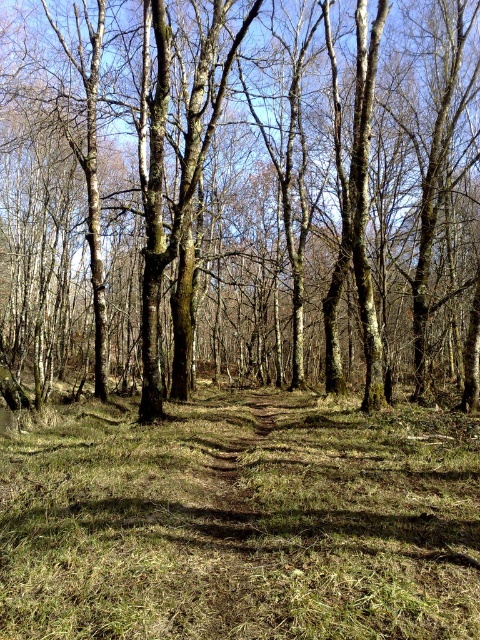
You are standing at the center of the dirt path in the forest scene. You notice a brown bark tree at center. Can you determine its exact position relative to your current location?

The brown bark tree at center is located at point coordinates of 0.303 on the x axis and 0.508 on the y axis.

You are a hiker walking along the narrow dirt path in the forest. You notice a brown bark tree at center and green grass at center. Which object is taller?

The brown bark tree at center is taller than the green grass at center.

You are a hiker walking along the narrow dirt path in the forest. You notice a brown bark tree at center and green grass at center. Which object is located to the left of the other?

The brown bark tree at center is positioned on the left side of green grass at center.